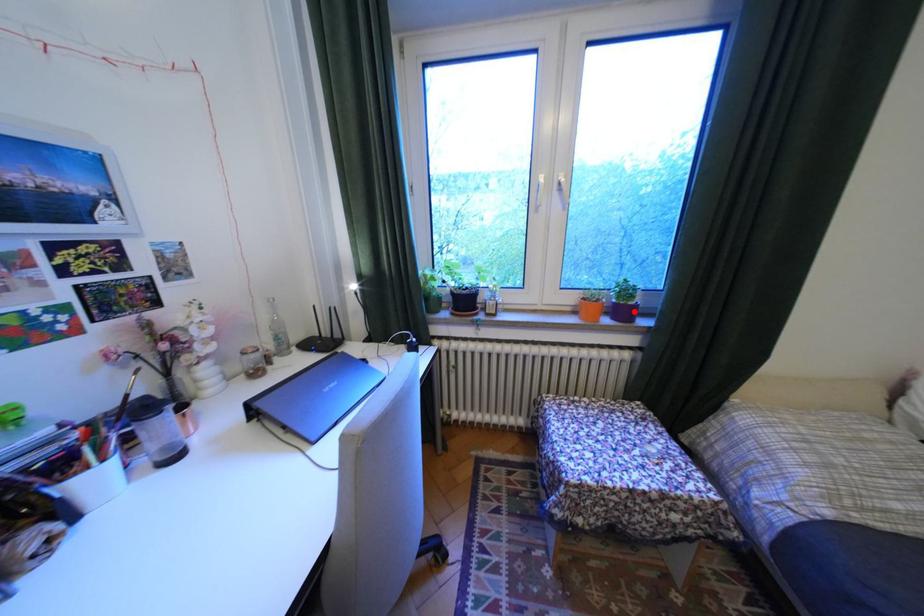
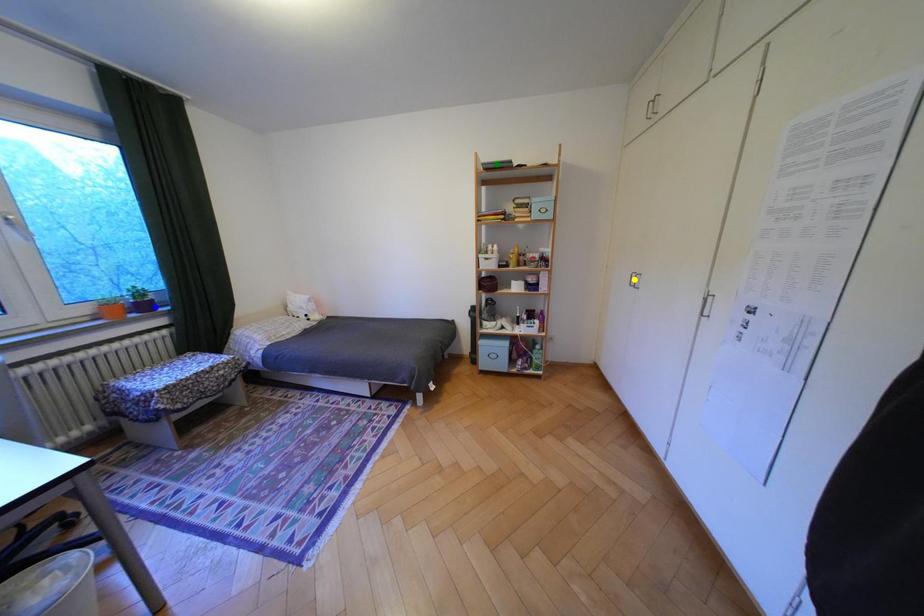
Question: I am providing you with two images of the same scene from different viewpoints. A red point is marked on the first image. You are given multiple points on the second image. In image 2, which mark is for the same physical point as the one in image 1?

Choices:
 (A) yellow point
 (B) green point
 (C) blue point

Answer: (C)